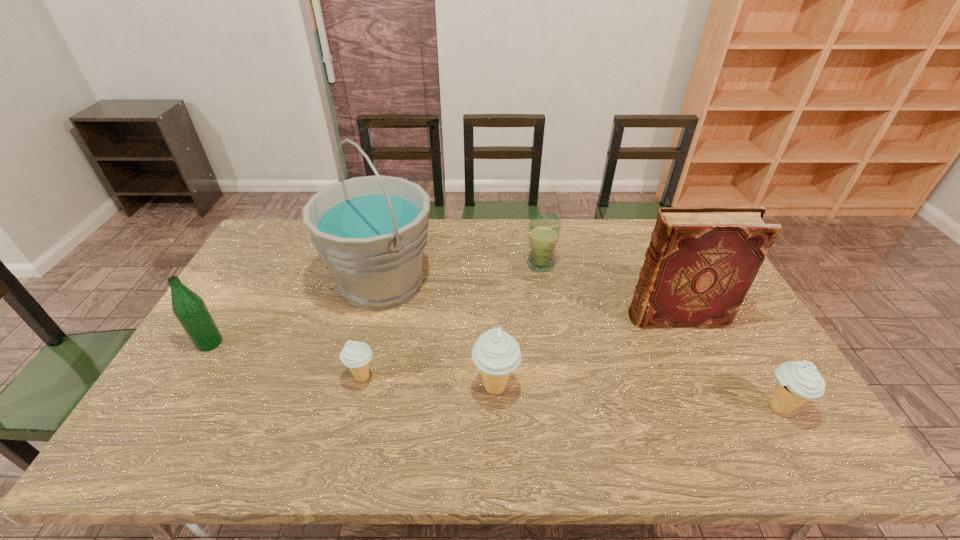
The width and height of the screenshot is (960, 540). Identify the location of free space for an extra icecream to achieve even spacing. (634, 397).